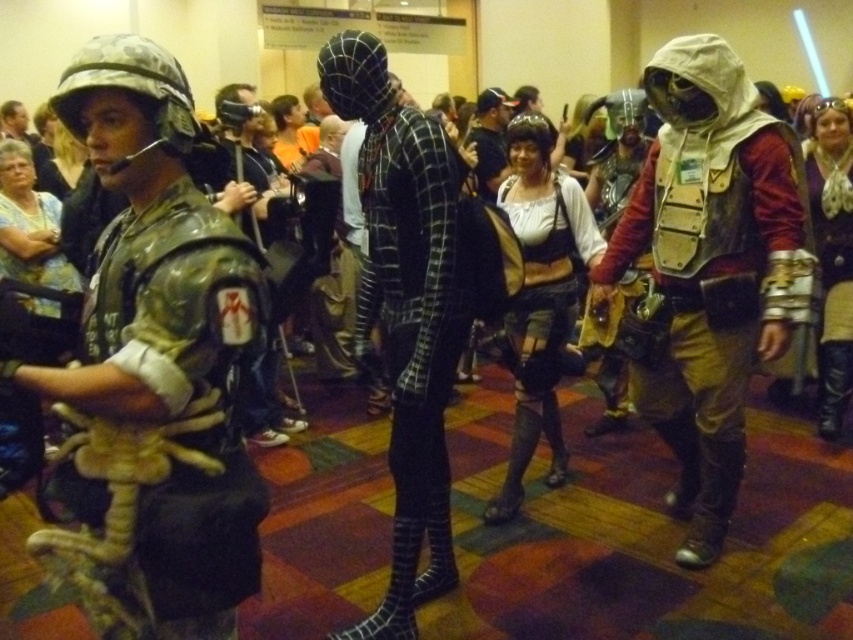
Between point (184, 332) and point (409, 132), which one is positioned in front?

Point (184, 332)

Does point (107, 392) come farther from viewer compared to point (407, 268)?

No, it is not.

This screenshot has height=640, width=853. Identify the location of metallic armor at left. (160, 424).

Does metallic armor at left appear over leather armor at right?

No.

Measure the distance between metallic armor at left and camera.

1.06 meters

The image size is (853, 640). What do you see at coordinates (160, 424) in the screenshot? I see `metallic armor at left` at bounding box center [160, 424].

The image size is (853, 640). Find the location of `metallic armor at left`. metallic armor at left is located at coordinates (160, 424).

Which is behind, point (650, 154) or point (437, 497)?

The point (650, 154) is more distant.

Looking at this image, is leather armor at right in front of black spandex suit at center?

No, leather armor at right is behind black spandex suit at center.

Where is `leather armor at right`? This screenshot has width=853, height=640. leather armor at right is located at coordinates (711, 269).